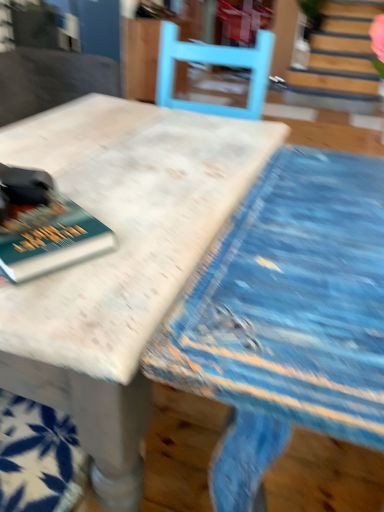
Where is `vacant area located to the right-hand side of hardcover book at left`? vacant area located to the right-hand side of hardcover book at left is located at coordinates (145, 247).